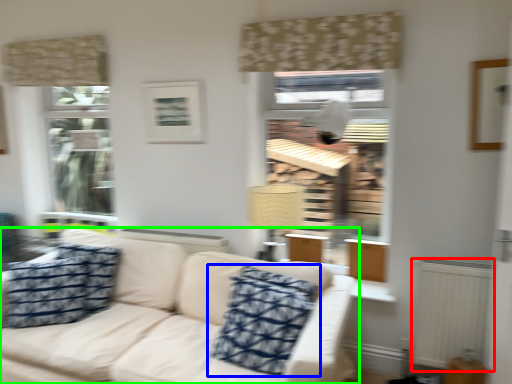
Question: Which object is positioned farthest from radiator (highlighted by a red box)? Select from pillow (highlighted by a blue box) and studio couch (highlighted by a green box).

Choices:
 (A) pillow
 (B) studio couch

Answer: (B)